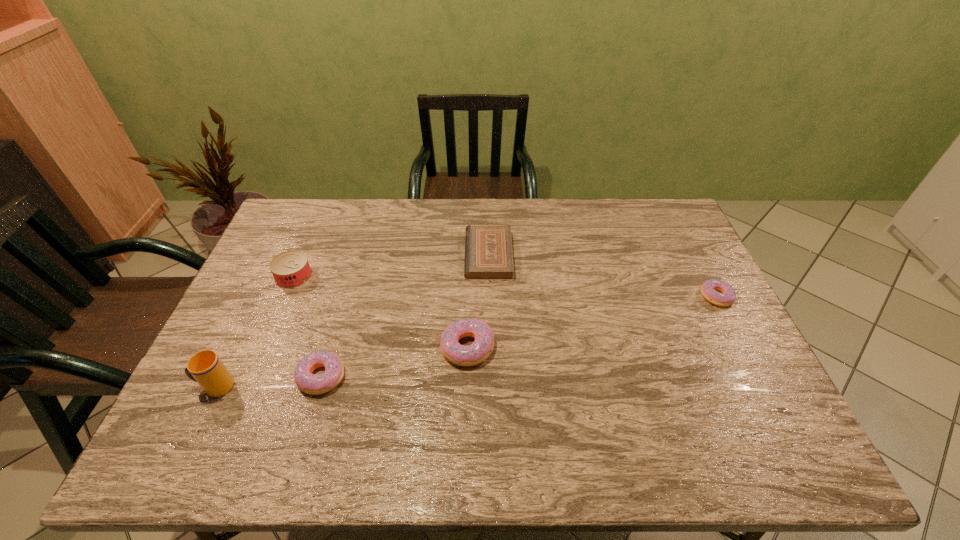
I want to click on free location that satisfies the following two spatial constraints: 1. on the spine side of the Bible; 2. on the front side of the can, so click(489, 276).